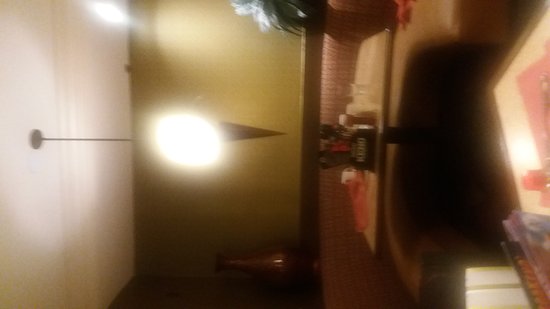
This screenshot has width=550, height=309. In order to click on ceiling light hanger in this screenshot , I will do `click(89, 138)`.